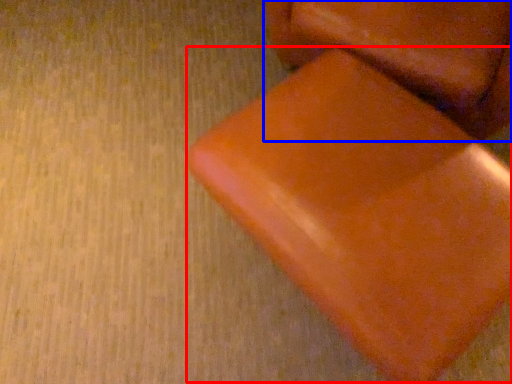
Question: Which of the following is the farthest to the observer, bean bag chair (highlighted by a red box) or furniture (highlighted by a blue box)?

Choices:
 (A) bean bag chair
 (B) furniture

Answer: (B)